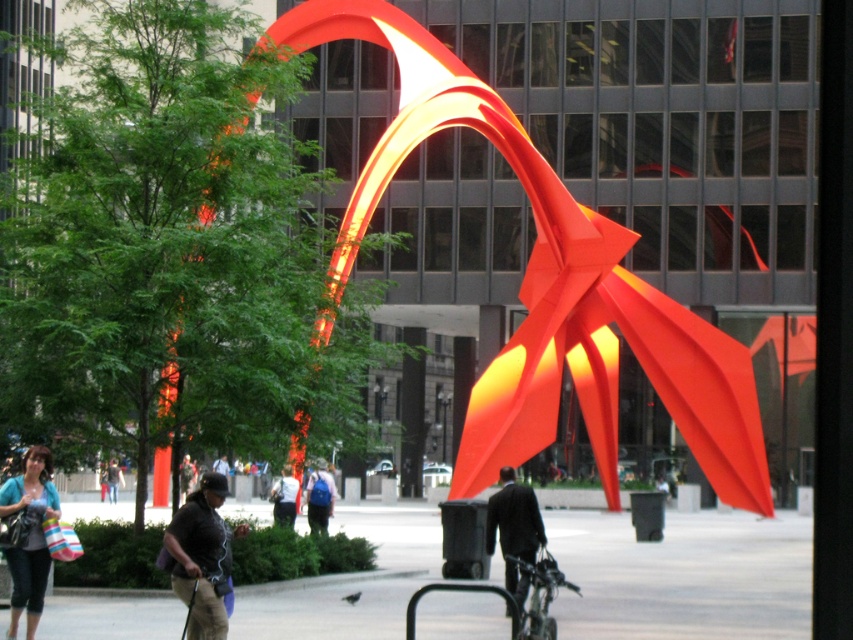
You are a fashion designer observing an urban scene. You notice a matte blue shirt at lower left and a light blue denim jacket at center. Which clothing item is positioned higher in the image?

The matte blue shirt at lower left is located above the light blue denim jacket at center, so the matte blue shirt at lower left is positioned higher in the image.